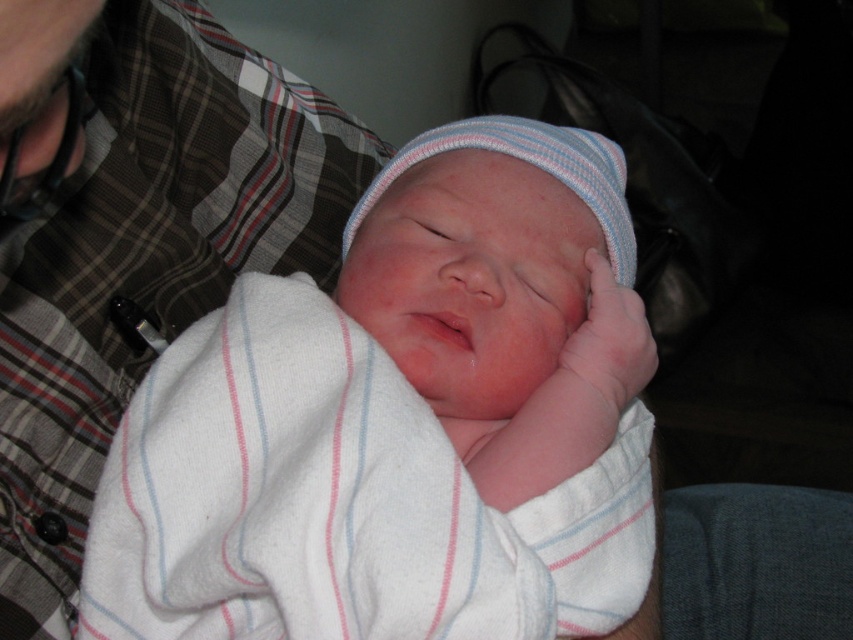
Question: Which point is farther from the camera taking this photo?

Choices:
 (A) (177, 620)
 (B) (606, 308)

Answer: (B)

Question: Can you confirm if white striped blanket at center is positioned to the left of pink soft fabric hand at center?

Choices:
 (A) yes
 (B) no

Answer: (A)

Question: Which point is farther from the camera taking this photo?

Choices:
 (A) pyautogui.click(x=112, y=576)
 (B) pyautogui.click(x=581, y=385)

Answer: (B)

Question: Can you confirm if white striped blanket at center is positioned above pink soft fabric hand at center?

Choices:
 (A) yes
 (B) no

Answer: (B)

Question: Which of the following is the closest to the observer?

Choices:
 (A) (393, 163)
 (B) (602, 292)

Answer: (B)

Question: Does white striped blanket at center appear on the right side of pink soft fabric hand at center?

Choices:
 (A) no
 (B) yes

Answer: (A)